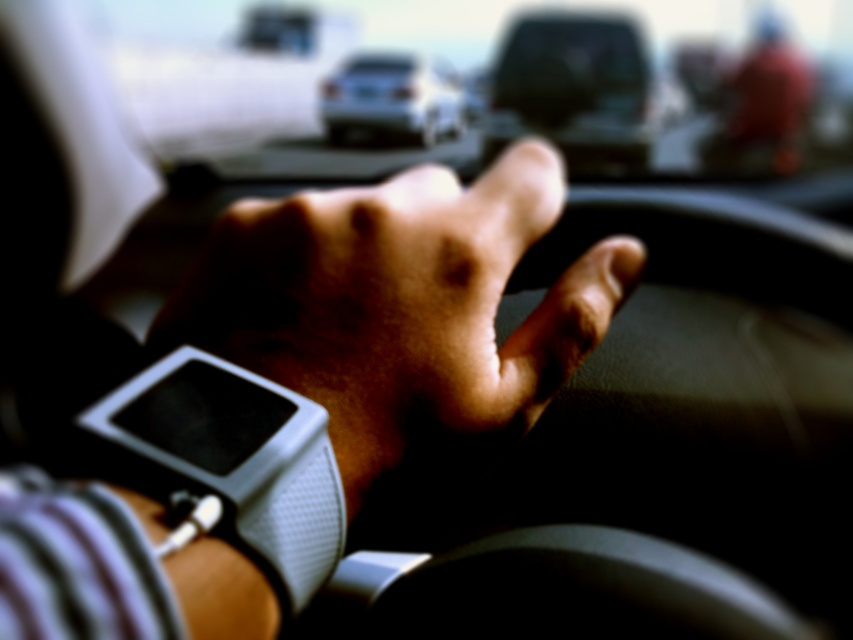
Question: Can you confirm if white matte watch at center is positioned to the left of silver metallic sedan at center?

Choices:
 (A) yes
 (B) no

Answer: (B)

Question: Among these objects, which one is farthest from the camera?

Choices:
 (A) silver metallic sedan at center
 (B) white matte watch at center

Answer: (A)

Question: Does white matte watch at center have a lesser width compared to silver metallic sedan at center?

Choices:
 (A) yes
 (B) no

Answer: (A)

Question: Is white matte watch at center behind silver metallic sedan at center?

Choices:
 (A) yes
 (B) no

Answer: (B)